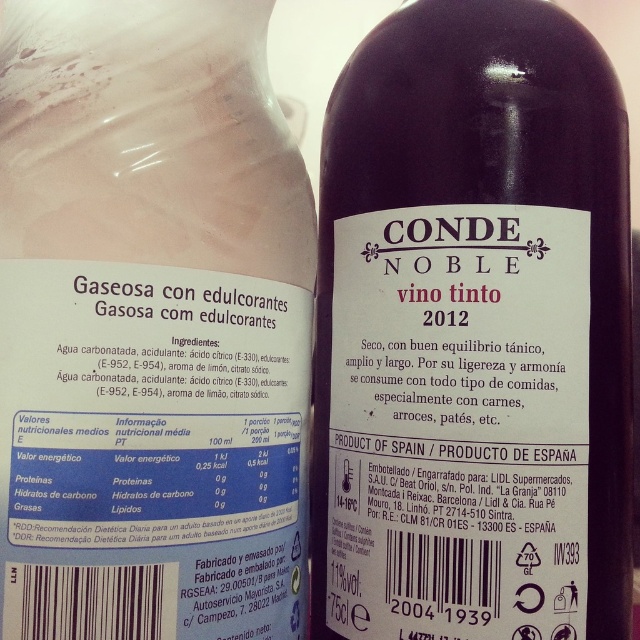
You are organizing a drinks station and need to stack the dark glass bottle at center and the pink matte bottle at center vertically. Which bottle should you place at the bottom to ensure stability?

The dark glass bottle at center is taller than the pink matte bottle at center, so placing the taller bottle at the bottom would provide better stability for the stack.

You are a delivery person who needs to place a new bottle of water between the dark glass bottle at center and the other container. Can you fit it if the bottle of water is 15 centimeters in diameter?

The two containers are 72.58 centimeters apart. A bottle of water with a 15 cm diameter would require at least 15 cm of space. Since 72.58 cm is more than enough, yes, you can fit the water bottle between them.

You are a bartender preparing a drink and need to reach for the dark glass bottle at center and the pink matte bottle at center. Which one will you grab first if you want to pick the one closer to you?

You will grab the dark glass bottle at center first because it is closer to you than the pink matte bottle at center.